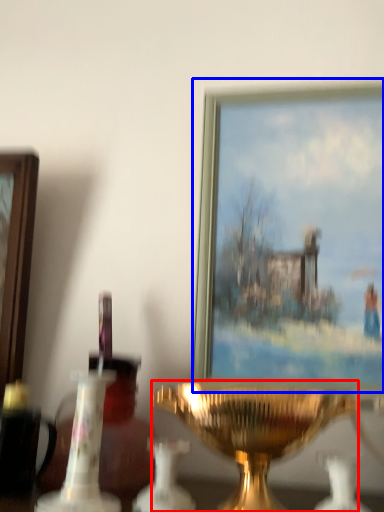
Question: Which of the following is the farthest to the observer, candle holder (highlighted by a red box) or picture frame (highlighted by a blue box)?

Choices:
 (A) candle holder
 (B) picture frame

Answer: (B)